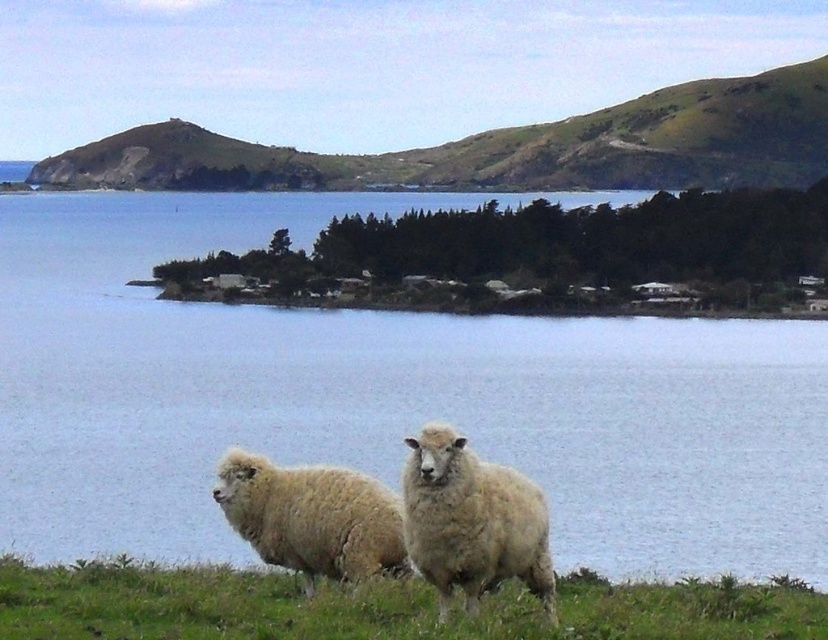
You are a photographer trying to capture the white fluffy grass at center and the white woolly sheep at center in the same frame. Based on their sizes and positions, which one appears larger in the image?

The white woolly sheep at center appears larger because it is positioned closer to the foreground compared to the white fluffy grass at center, which is further back.

You are a photographer trying to capture the white fluffy grass at center and the white woolly sheep at center in a single shot. Based on their sizes in the image, which one should you focus on to ensure both are clearly visible?

The white fluffy grass at center is smaller than the white woolly sheep at center, so focusing on the white woolly sheep at center will help ensure both are clearly visible as the sheep is larger and easier to focus on.

You are standing at the point marked by the coordinates point (383, 396) in the image. Looking around, you see the blue water at center. Which direction would you face to look towards the larger sheep?

The point (383, 396) marks the blue water at center. Since the larger sheep is positioned closer to the foreground, you would need to face towards the foreground direction to look towards the larger sheep.